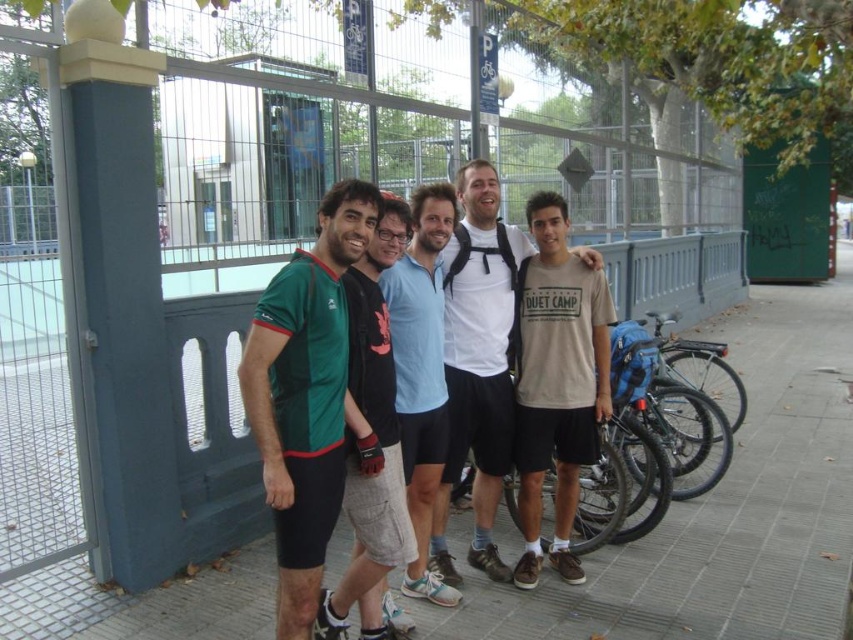
What do you see at coordinates (305, 396) in the screenshot? I see `green matte jersey at center` at bounding box center [305, 396].

The width and height of the screenshot is (853, 640). Describe the element at coordinates (305, 396) in the screenshot. I see `green matte jersey at center` at that location.

Locate an element on the screen. Image resolution: width=853 pixels, height=640 pixels. green matte jersey at center is located at coordinates (305, 396).

Between white matte t-shirt at center and green fabric shirt at center, which one appears on the right side from the viewer's perspective?

Positioned to the right is white matte t-shirt at center.

Does point (457, 333) come closer to viewer compared to point (402, 216)?

No, (457, 333) is further to viewer.

Does point (469, 257) come behind point (387, 346)?

Yes.

Locate an element on the screen. The height and width of the screenshot is (640, 853). white matte t-shirt at center is located at coordinates (477, 362).

Measure the distance from matte beige t-shirt at center to light blue cotton shirt at center.

The distance of matte beige t-shirt at center from light blue cotton shirt at center is 24.08 inches.

Between point (520, 433) and point (431, 324), which one is positioned behind?

Point (520, 433)

Identify the location of matte beige t-shirt at center. The height and width of the screenshot is (640, 853). (556, 381).